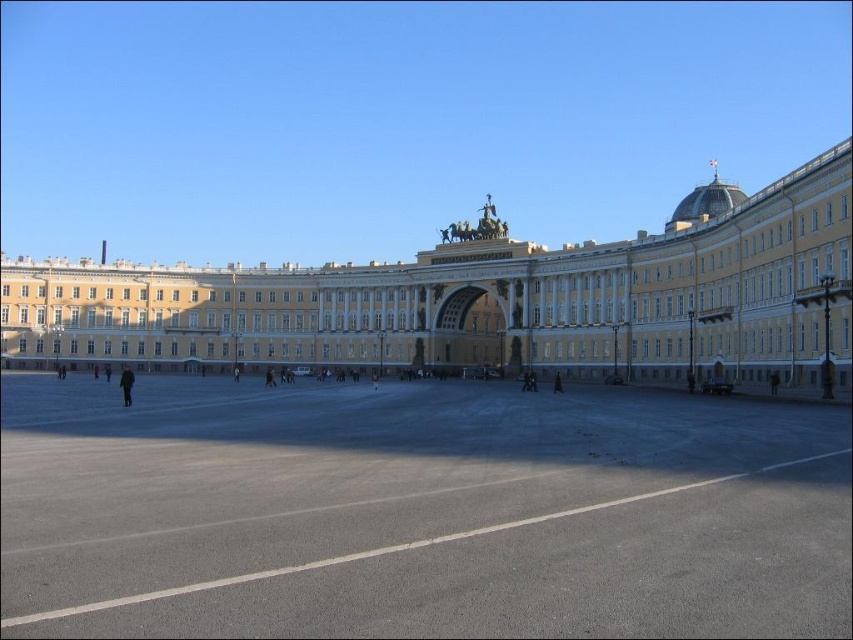
Question: Is gray asphalt at center thinner than white stone building at center?

Choices:
 (A) yes
 (B) no

Answer: (A)

Question: Is gray asphalt at center smaller than white stone building at center?

Choices:
 (A) no
 (B) yes

Answer: (B)

Question: Which object is farther from the camera taking this photo?

Choices:
 (A) gray asphalt at center
 (B) white stone building at center

Answer: (B)

Question: Which object is farther from the camera taking this photo?

Choices:
 (A) gray asphalt at center
 (B) white stone building at center

Answer: (B)

Question: Which point appears closest to the camera in this image?

Choices:
 (A) (248, 321)
 (B) (248, 536)

Answer: (B)

Question: Is gray asphalt at center closer to the viewer compared to white stone building at center?

Choices:
 (A) no
 (B) yes

Answer: (B)